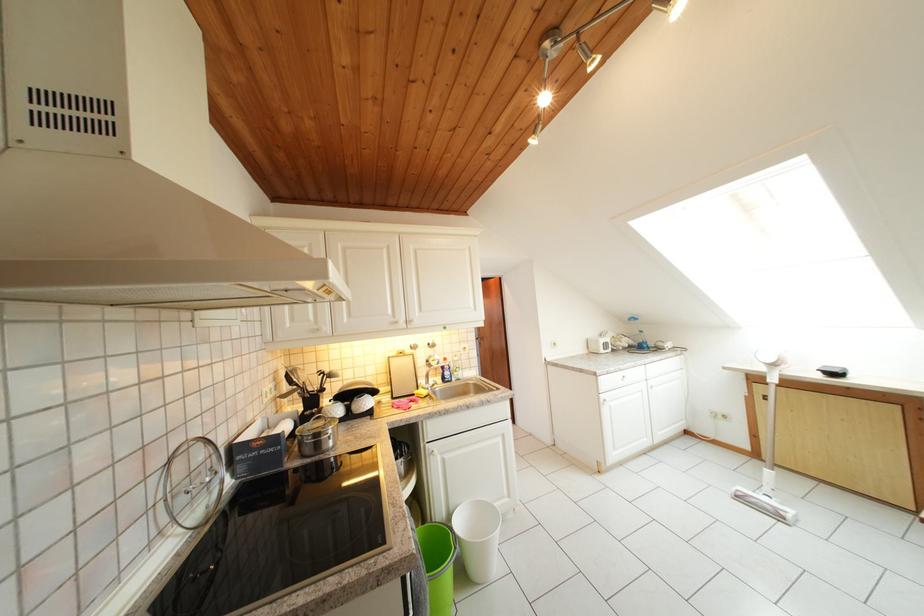
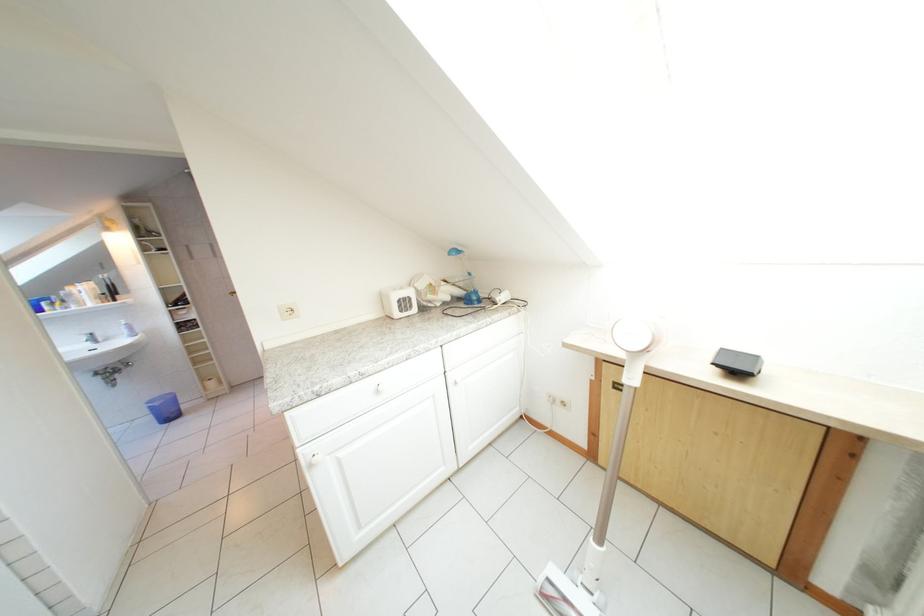
Which direction would the cameraman need to move to produce the second image?

The cameraman walked toward right, forward.